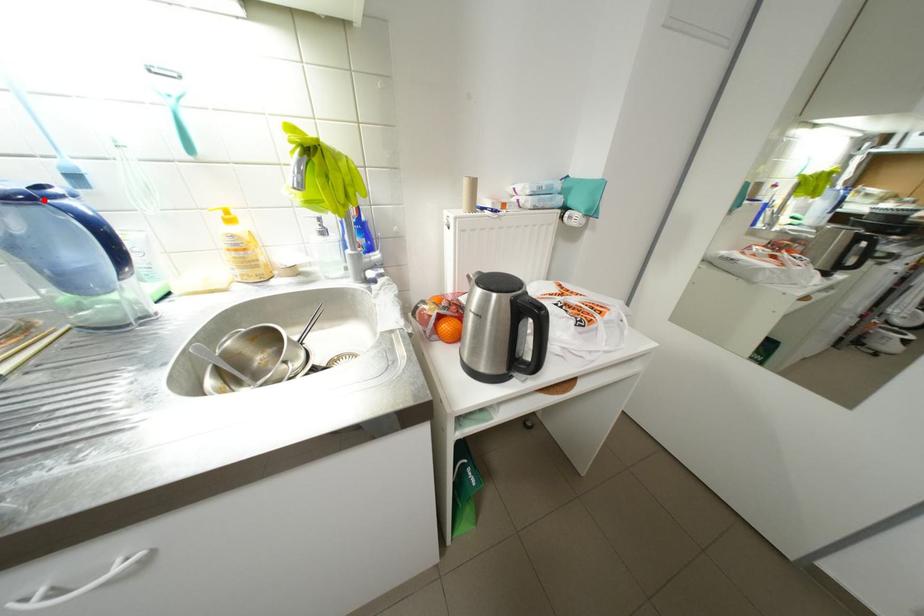
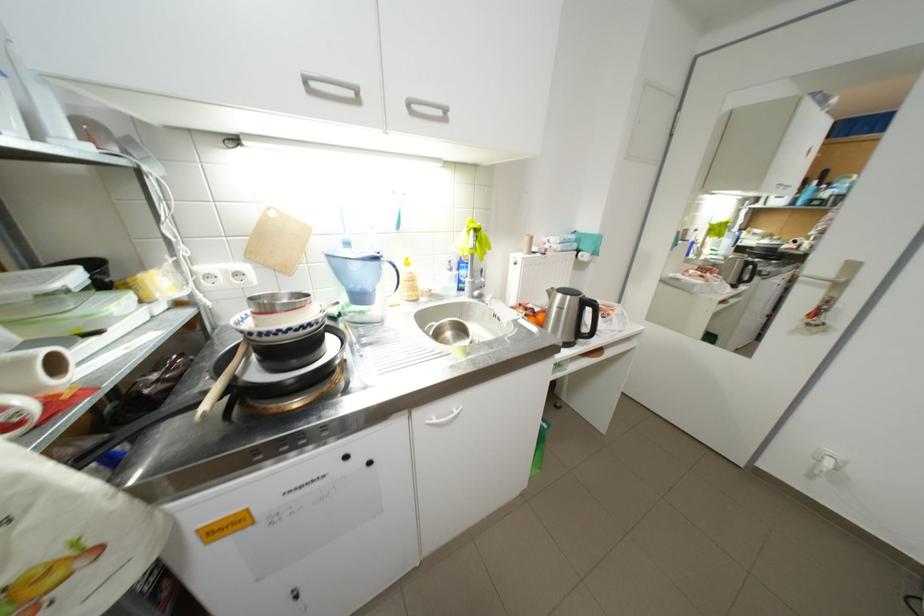
Find the pixel in the second image that matches the highlighted location in the first image.

(387, 259)